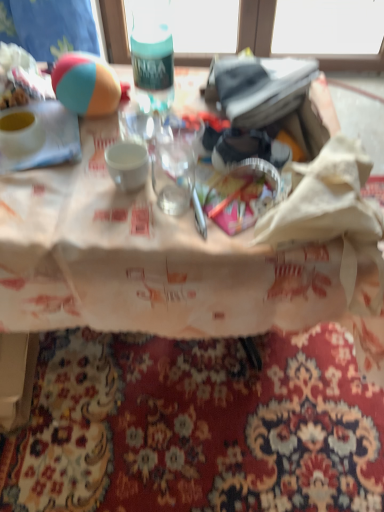
Identify the location of vacant space in between matte white bowl at upper left and translucent plastic cup at center. Image resolution: width=384 pixels, height=512 pixels. (104, 168).